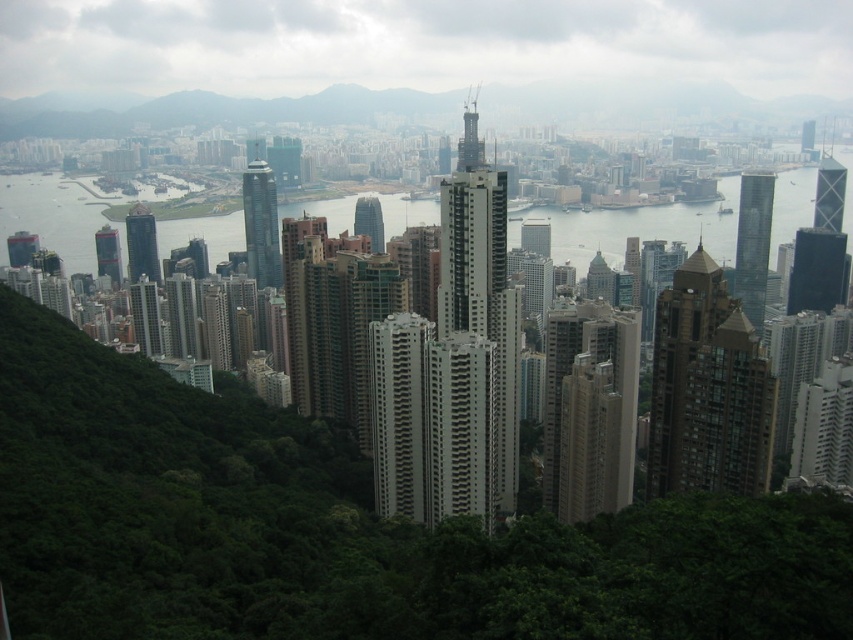
Question: Can you confirm if brown glassy building at center is positioned below glassy reflective skyscraper at right?

Choices:
 (A) yes
 (B) no

Answer: (A)

Question: Does glassy reflective skyscraper at center appear over glassy skyscraper at center?

Choices:
 (A) no
 (B) yes

Answer: (A)

Question: Which of these objects is positioned farthest from the matte glass skyscraper at center?

Choices:
 (A) glassy reflective skyscraper at center
 (B) matte glass skyscraper at center-left
 (C) metallic glass skyscraper at upper right

Answer: (C)

Question: Which is nearer to the brown glassy building at center?

Choices:
 (A) glassy reflective skyscraper at right
 (B) matte glass skyscraper at center

Answer: (A)

Question: Does matte glass skyscraper at center-left have a lesser width compared to glassy blue skyscraper at center?

Choices:
 (A) no
 (B) yes

Answer: (A)

Question: Which of the following is the closest to the observer?

Choices:
 (A) glassy reflective skyscraper at center
 (B) glassy reflective skyscraper at right
 (C) brown glassy building at center

Answer: (A)